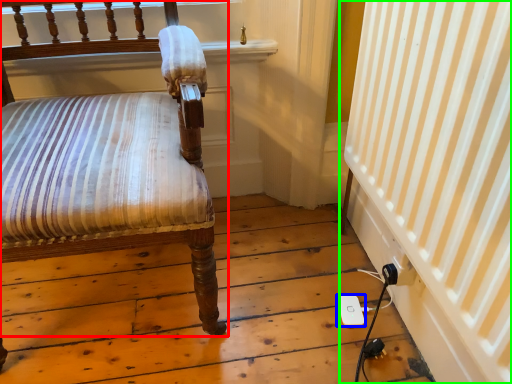
Question: Which is nearer to the chair (highlighted by a red box)? ipod (highlighted by a blue box) or curtain (highlighted by a green box).

Choices:
 (A) ipod
 (B) curtain

Answer: (B)